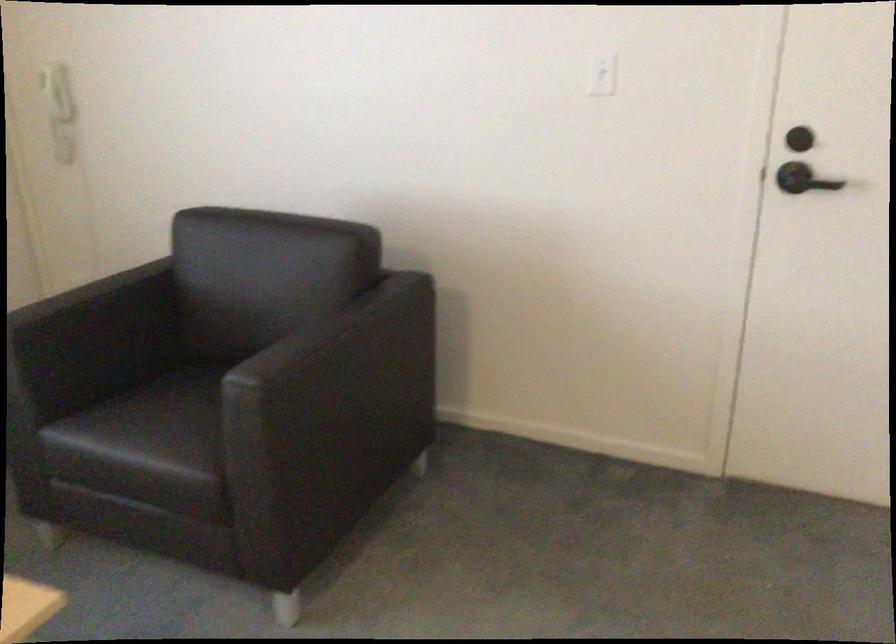
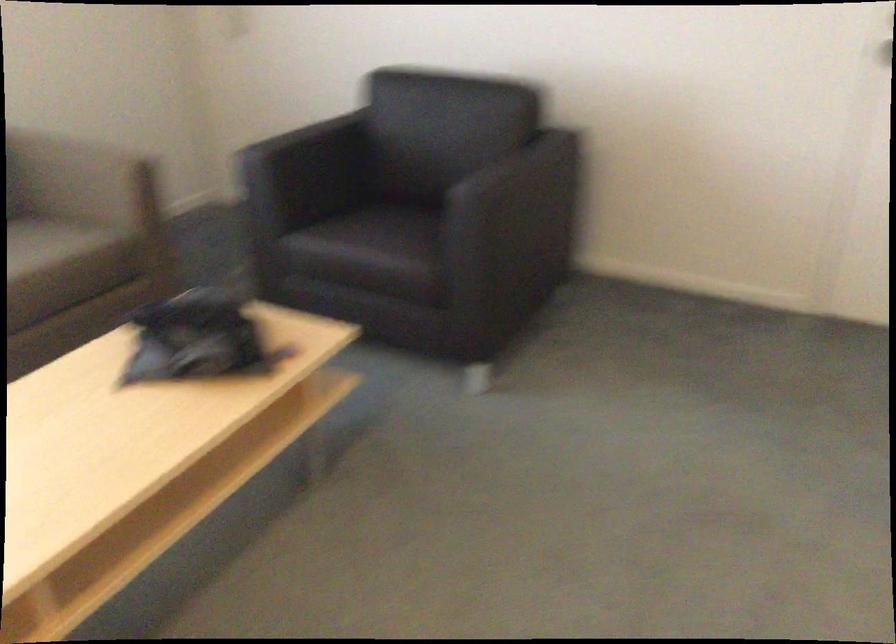
In the second image, find the point that corresponds to point (135, 440) in the first image.

(368, 240)